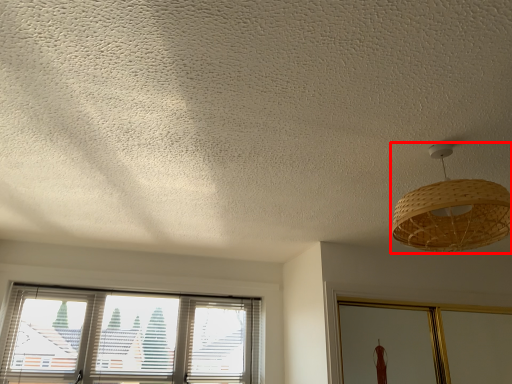
Question: Considering the relative positions of lamp (annotated by the red box) and window in the image provided, where is lamp (annotated by the red box) located with respect to the staircase?

Choices:
 (A) right
 (B) left

Answer: (A)